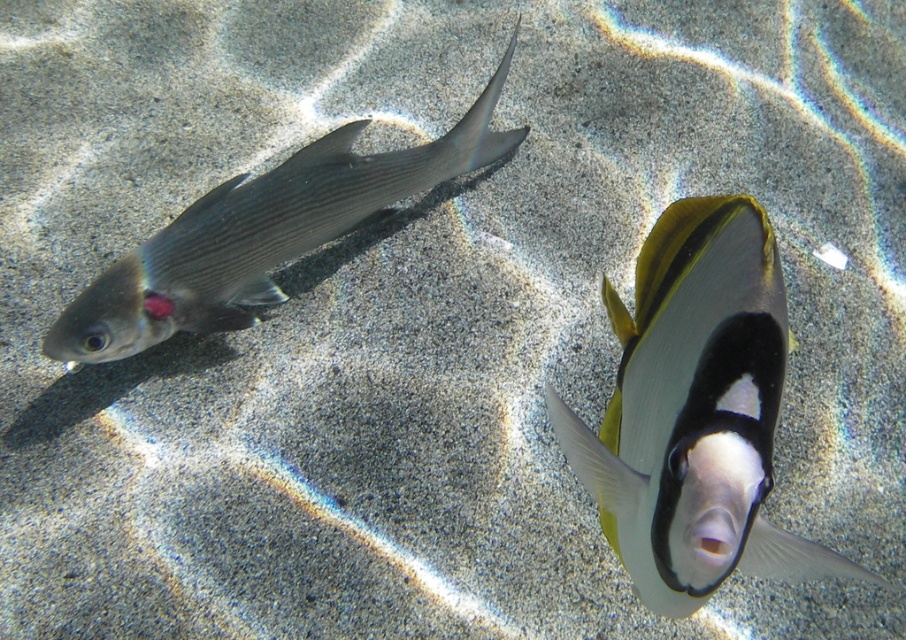
You are a marine biologist observing the underwater scene. You need to determine which fish is narrower between the black glossy fish at center and the shiny silver fish at left. Which one is narrower?

The black glossy fish at center has a lesser width compared to the shiny silver fish at left, so the black glossy fish at center is narrower.

You are a marine biologist observing underwater. You want to take a closeup photo of the black glossy fish at center. Your camera has a minimum focus distance of 60 centimeters. Can you get a clear photo without moving closer?

The black glossy fish at center is 63.69 centimeters away from the viewer. Since the camera requires at least 60 centimeters for focus, the distance is sufficient. Therefore, a clear photo can be captured without moving closer.

You are a marine biologist observing underwater. You notice the black glossy fish at center and the shiny silver fish at left. Which fish is closer to the surface of the water?

The black glossy fish at center is closer to the surface of the water because it is in front of the shiny silver fish at left, indicating it is nearer to the observer.